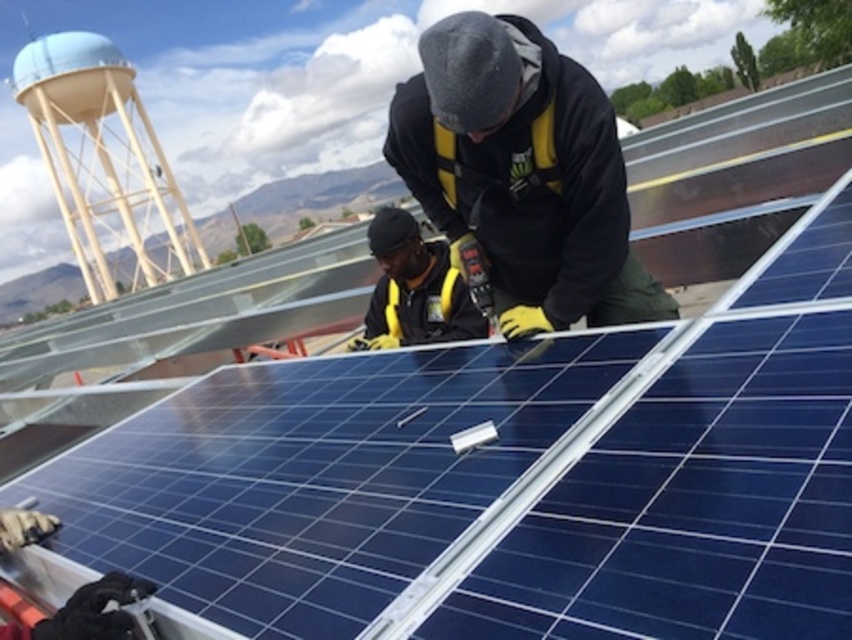
Is white matte water tower at upper left wider than yellow safety vest at center?

Indeed, white matte water tower at upper left has a greater width compared to yellow safety vest at center.

Looking at this image, is white matte water tower at upper left below yellow safety vest at center?

No, white matte water tower at upper left is not below yellow safety vest at center.

Between point (47, 58) and point (403, 280), which one is positioned in front?

Point (403, 280)

At what (x,y) coordinates should I click in order to perform the action: click on white matte water tower at upper left. Please return your answer as a coordinate pair (x, y). The height and width of the screenshot is (640, 852). Looking at the image, I should click on (104, 164).

What do you see at coordinates (522, 173) in the screenshot?
I see `yellow reflective safety vest at center` at bounding box center [522, 173].

Between point (573, 81) and point (406, 216), which one is positioned in front?

Point (573, 81) is more forward.

Which is behind, point (514, 228) or point (373, 216)?

The point (373, 216) is behind.

Where is `yellow reflective safety vest at center`? The width and height of the screenshot is (852, 640). yellow reflective safety vest at center is located at coordinates (522, 173).

Does yellow reflective safety vest at center appear over white matte water tower at upper left?

Actually, yellow reflective safety vest at center is below white matte water tower at upper left.

Between yellow reflective safety vest at center and white matte water tower at upper left, which one has more height?

white matte water tower at upper left is taller.

This screenshot has width=852, height=640. Identify the location of yellow reflective safety vest at center. tap(522, 173).

The width and height of the screenshot is (852, 640). I want to click on yellow reflective safety vest at center, so click(x=522, y=173).